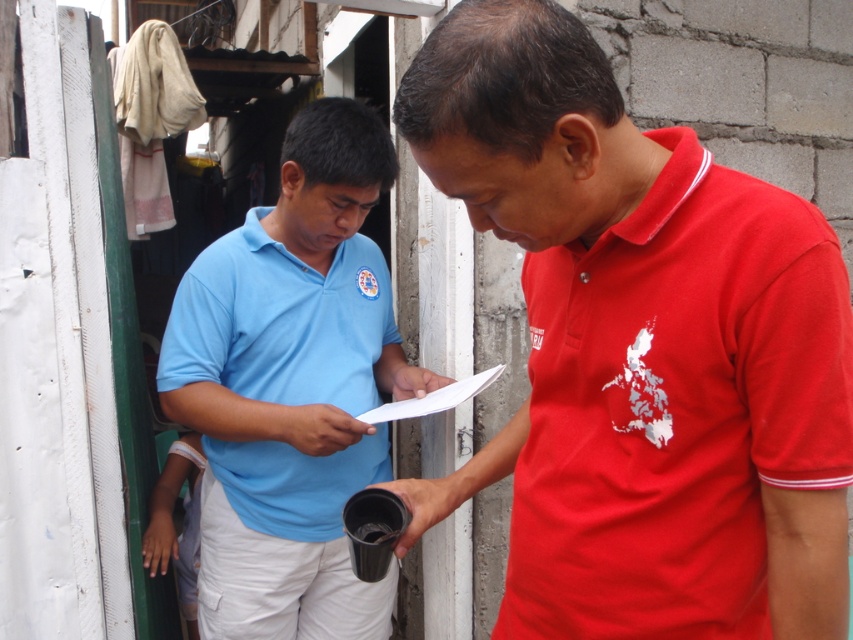
Question: Which of the following is the closest to the observer?

Choices:
 (A) (509, 614)
 (B) (334, 518)

Answer: (A)

Question: Does matte red polo shirt at center have a smaller size compared to matte blue polo shirt at center?

Choices:
 (A) yes
 (B) no

Answer: (A)

Question: Does matte red polo shirt at center appear under matte blue polo shirt at center?

Choices:
 (A) no
 (B) yes

Answer: (A)

Question: Which object appears closest to the camera in this image?

Choices:
 (A) matte red polo shirt at center
 (B) matte blue polo shirt at center

Answer: (A)

Question: Does matte red polo shirt at center appear under matte blue polo shirt at center?

Choices:
 (A) yes
 (B) no

Answer: (B)